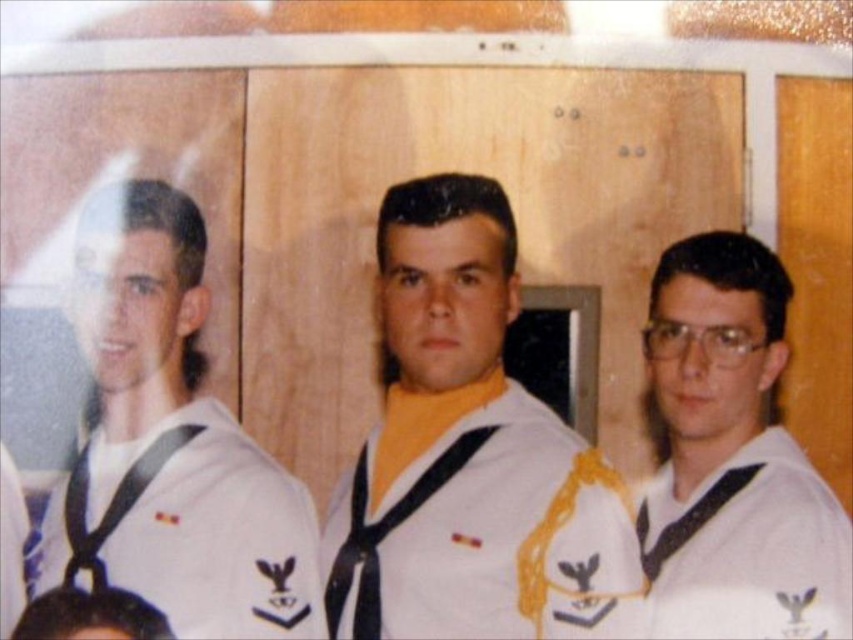
Between point (496, 374) and point (227, 547), which one is positioned in front?

Point (227, 547) is more forward.

Is the position of white matte uniform at center more distant than that of white matte uniform at left?

No, it is in front of white matte uniform at left.

What do you see at coordinates (468, 452) in the screenshot? I see `white matte uniform at center` at bounding box center [468, 452].

The width and height of the screenshot is (853, 640). Identify the location of white matte uniform at center. (468, 452).

Who is positioned more to the right, white matte uniform at left or white matte sailor uniform at right?

white matte sailor uniform at right

I want to click on white matte uniform at left, so click(x=169, y=444).

Consider the image. Does white matte uniform at center have a greater height compared to white matte sailor uniform at right?

Yes, white matte uniform at center is taller than white matte sailor uniform at right.

Does point (402, 554) lie in front of point (715, 618)?

Yes, it is.

What are the coordinates of `white matte uniform at center` in the screenshot? It's located at (468, 452).